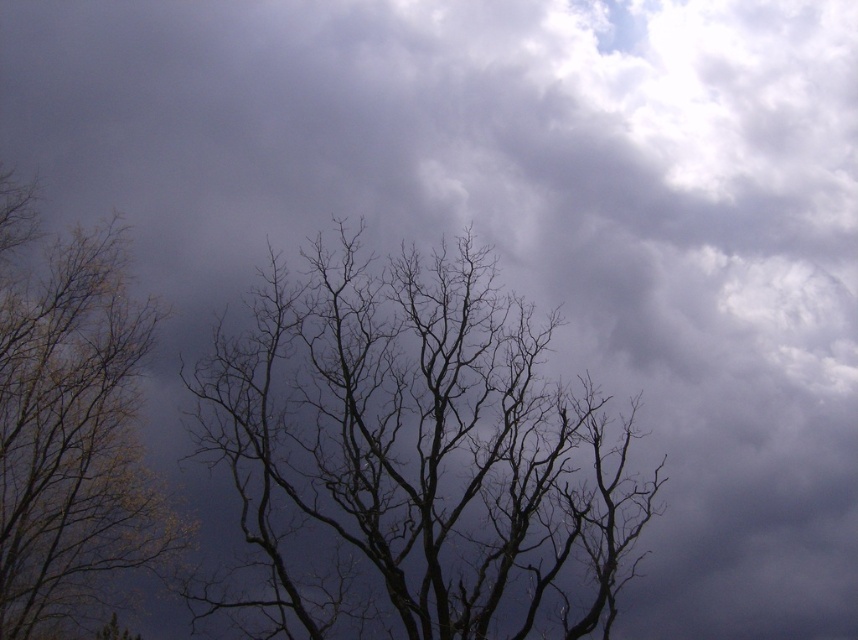
Can you confirm if black matte tree at center is bigger than yellow-green leaves at left?

Yes.

In the scene shown: Can you confirm if black matte tree at center is positioned to the right of yellow-green leaves at left?

Yes, black matte tree at center is to the right of yellow-green leaves at left.

The image size is (858, 640). Describe the element at coordinates (418, 451) in the screenshot. I see `black matte tree at center` at that location.

Find the location of a particular element. The image size is (858, 640). black matte tree at center is located at coordinates (418, 451).